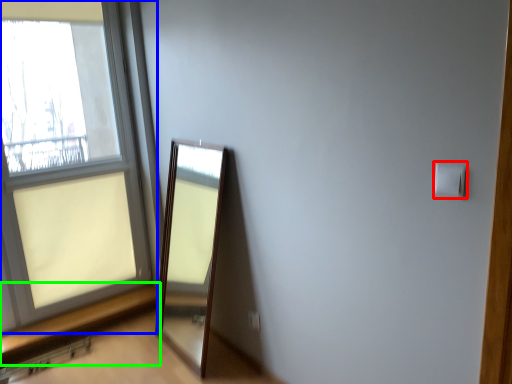
Question: Which object is positioned closest to light switch (highlighted by a red box)? Select from window (highlighted by a blue box) and window sill (highlighted by a green box).

Choices:
 (A) window
 (B) window sill

Answer: (B)